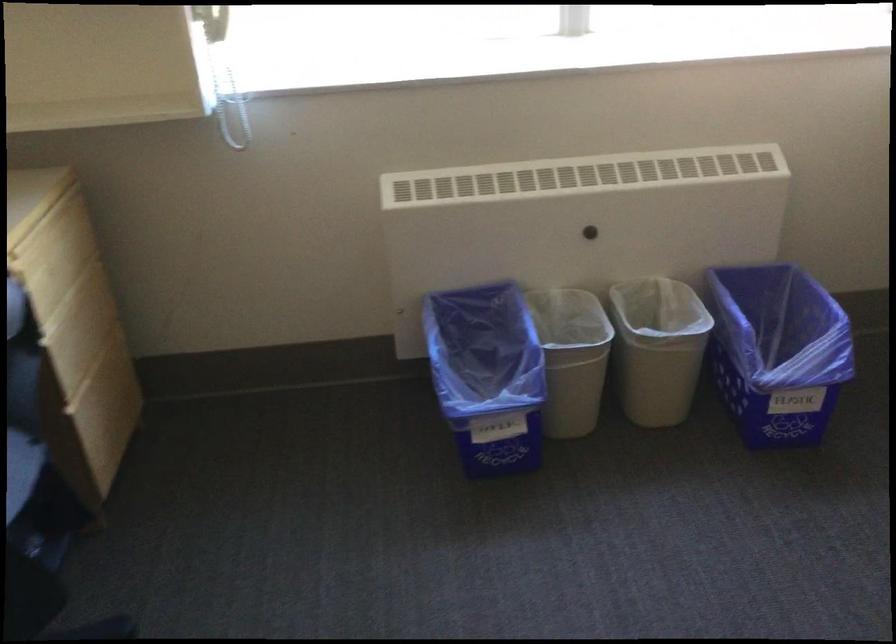
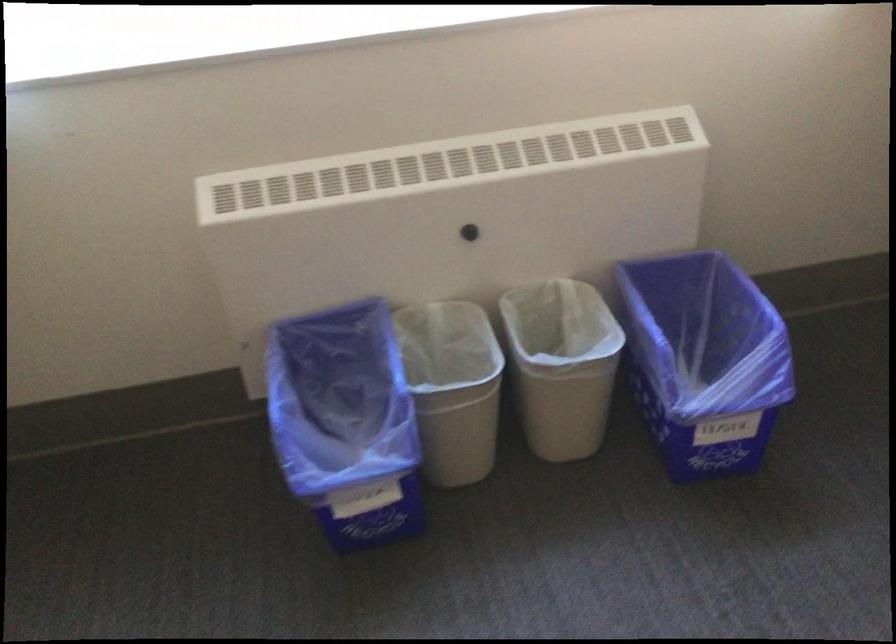
Question: The first image is from the beginning of the video and the second image is from the end. How did the camera likely rotate when shooting the video?

Choices:
 (A) Left
 (B) Right
 (C) Up
 (D) Down

Answer: (D)